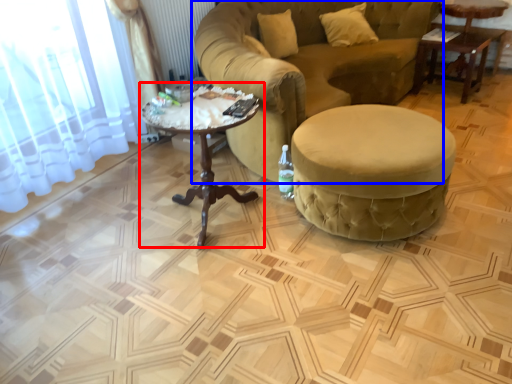
Question: Which of the following is the farthest to the observer, coffee table (highlighted by a red box) or studio couch (highlighted by a blue box)?

Choices:
 (A) coffee table
 (B) studio couch

Answer: (B)